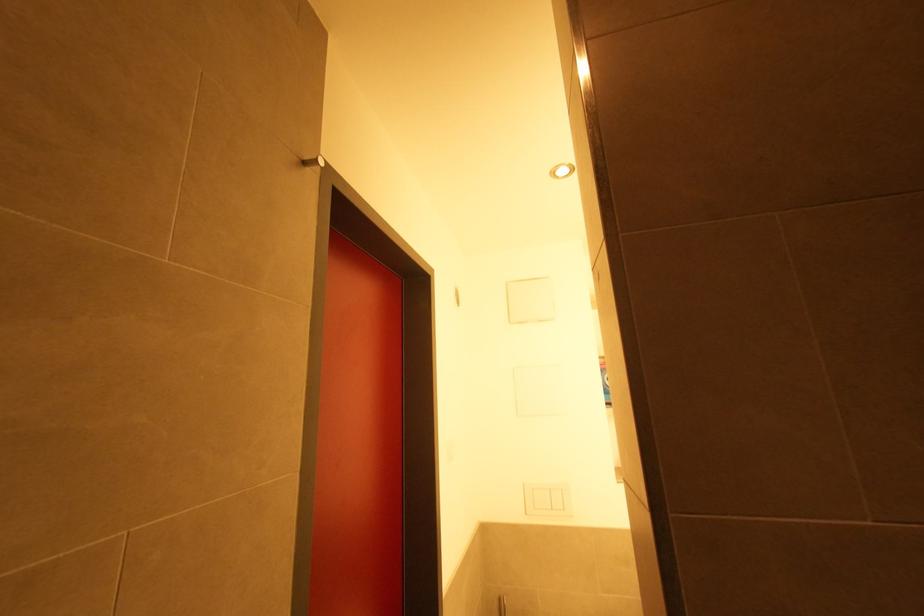
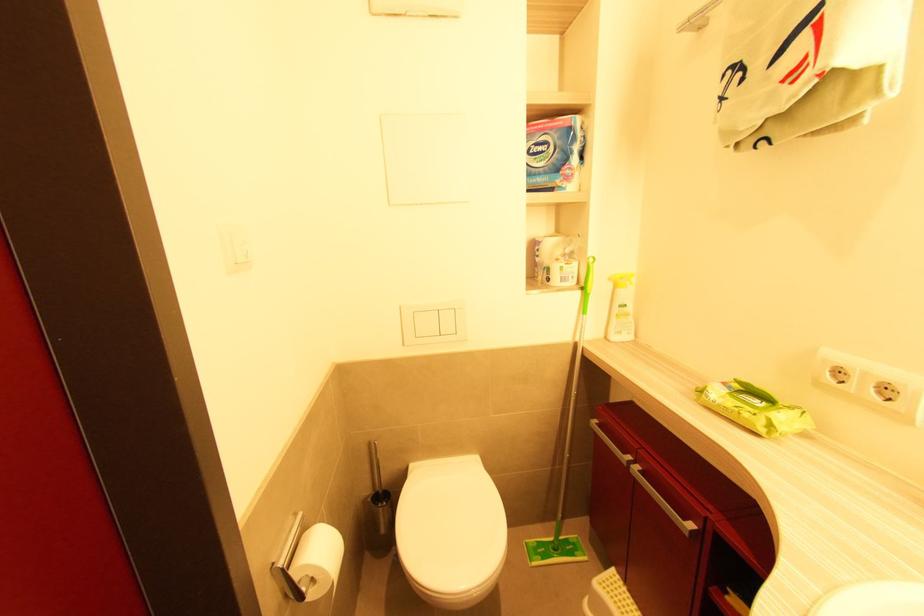
Based on the continuous images, in which direction is the camera rotating?

The camera rotated toward right-down.